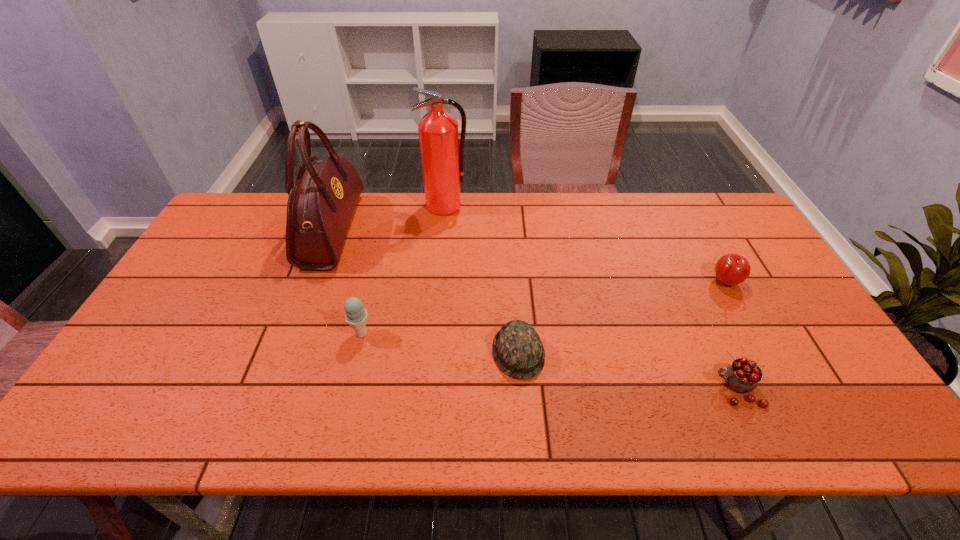
This screenshot has width=960, height=540. I want to click on free point that satisfies the following two spatial constraints: 1. on the front-facing side of the leftmost object; 2. on the left side of the rightmost object, so tap(312, 283).

At what (x,y) coordinates should I click in order to perform the action: click on vacant space that satisfies the following two spatial constraints: 1. on the front-facing side of the handbag; 2. on the left side of the farther cherry. Please return your answer as a coordinate pair (x, y). This screenshot has height=540, width=960. Looking at the image, I should click on (312, 283).

This screenshot has height=540, width=960. In order to click on blank space that satisfies the following two spatial constraints: 1. on the handle side of the nearer cherry; 2. on the front-facing side of the handbag in this screenshot , I will do `click(663, 230)`.

The width and height of the screenshot is (960, 540). Find the location of `free location that satisfies the following two spatial constraints: 1. on the back side of the third object from right to left; 2. on the front-facing side of the handbag`. free location that satisfies the following two spatial constraints: 1. on the back side of the third object from right to left; 2. on the front-facing side of the handbag is located at coordinates (510, 230).

You are a GUI agent. You are given a task and a screenshot of the screen. Output one action in this format:
    pyautogui.click(x=<x>, y=<y>)
    Task: Click on the vacant area that satisfies the following two spatial constraints: 1. on the front-facing side of the handbag; 2. on the handle side of the nearer cherry
    
    Given the screenshot: What is the action you would take?
    pyautogui.click(x=273, y=389)

This screenshot has height=540, width=960. I want to click on vacant position in the image that satisfies the following two spatial constraints: 1. on the handle side of the left cherry; 2. at the nozzle of the fire extinguisher, so click(652, 205).

Identify the location of vacant region that satisfies the following two spatial constraints: 1. on the front-facing side of the second object from left to right; 2. on the right side of the leftmost object. (294, 334).